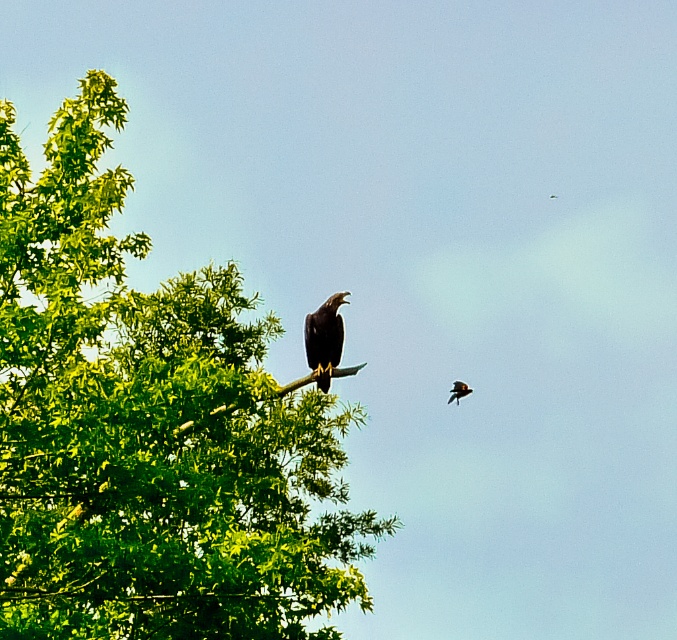
Between green leafy tree at left and shiny black crow at upper right, which one is positioned higher?

green leafy tree at left is above.

Where is `green leafy tree at left`? The width and height of the screenshot is (677, 640). green leafy tree at left is located at coordinates (150, 428).

Find the location of a particular element. green leafy tree at left is located at coordinates (150, 428).

Is green leafy tree at left to the right of shiny black eagle at upper center from the viewer's perspective?

Incorrect, green leafy tree at left is not on the right side of shiny black eagle at upper center.

Between point (232, 310) and point (315, 380), which one is positioned in front?

Positioned in front is point (232, 310).

This screenshot has width=677, height=640. Find the location of `green leafy tree at left`. green leafy tree at left is located at coordinates (150, 428).

Looking at this image, who is positioned more to the left, shiny black eagle at upper center or shiny black crow at upper right?

Positioned to the left is shiny black eagle at upper center.

Is shiny black eagle at upper center to the left of shiny black crow at upper right from the viewer's perspective?

Yes, shiny black eagle at upper center is to the left of shiny black crow at upper right.

Which is in front, point (322, 305) or point (452, 397)?

Point (322, 305) is in front.

Find the location of a particular element. The width and height of the screenshot is (677, 640). shiny black eagle at upper center is located at coordinates (324, 339).